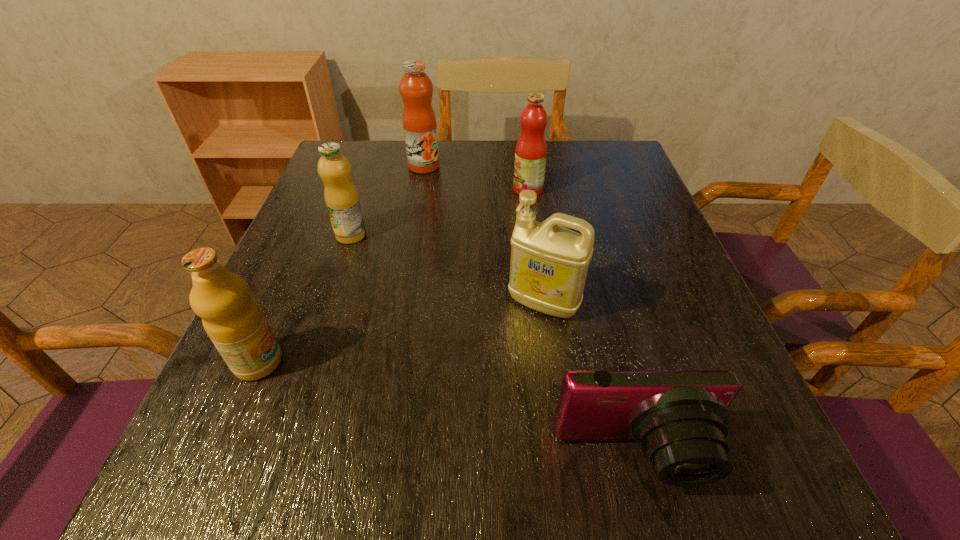
Locate an element on the screen. object present at the near right corner is located at coordinates (680, 417).

What are the coordinates of `free location at the far edge` in the screenshot? It's located at (476, 178).

Identify the location of vacant area at the near edge of the desktop. The image size is (960, 540). (578, 456).

Locate an element on the screen. This screenshot has height=540, width=960. blank space at the left edge is located at coordinates (264, 431).

Locate an element on the screen. The height and width of the screenshot is (540, 960). vacant region at the right edge of the desktop is located at coordinates (709, 355).

In the image, there is a desktop. Where is `vacant space at the far right corner`? This screenshot has width=960, height=540. vacant space at the far right corner is located at coordinates (618, 168).

You are a GUI agent. You are given a task and a screenshot of the screen. Output one action in this format:
    pyautogui.click(x=<x>, y=<y>)
    Task: Click on the unoccupied area between the second nearest fruit juice and the fourth farthest object
    This screenshot has width=960, height=540.
    Given the screenshot: What is the action you would take?
    pyautogui.click(x=447, y=269)

This screenshot has width=960, height=540. In order to click on free space that is in between the farthest fruit juice and the nearest object in this screenshot , I will do `click(529, 312)`.

Find the location of a particular element. free spot between the leftmost fruit juice and the rightmost fruit juice is located at coordinates (393, 276).

In order to click on free spot between the nearest fruit juice and the second farthest object in this screenshot , I will do `click(393, 276)`.